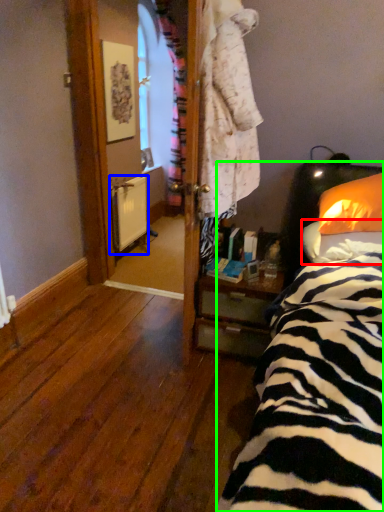
Question: Which object is the closest to the pillow (highlighted by a red box)? Choose among these: radiator (highlighted by a blue box) or bed (highlighted by a green box).

Choices:
 (A) radiator
 (B) bed

Answer: (B)